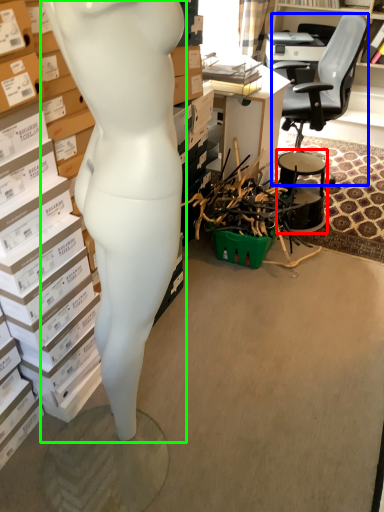
Question: Estimate the real-world distances between objects in this image. Which object is closer to drum (highlighted by a red box), chair (highlighted by a blue box) or person (highlighted by a green box)?

Choices:
 (A) chair
 (B) person

Answer: (A)